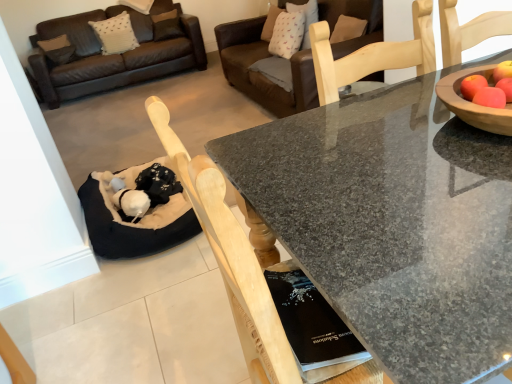
Question: Considering the positions of brown leather couch at upper center and black fabric cat bed at lower left in the image, is brown leather couch at upper center bigger or smaller than black fabric cat bed at lower left?

Choices:
 (A) big
 (B) small

Answer: (A)

Question: Considering their positions, is brown leather couch at upper center located in front of or behind black fabric cat bed at lower left?

Choices:
 (A) behind
 (B) front

Answer: (A)

Question: Estimate the real-world distances between objects in this image. Which object is closer to the brown leather couch at upper center?

Choices:
 (A) granite table at center
 (B) black fabric cat bed at lower left

Answer: (B)

Question: Which of these objects is positioned farthest from the granite table at center?

Choices:
 (A) brown leather couch at upper center
 (B) black fabric cat bed at lower left

Answer: (A)